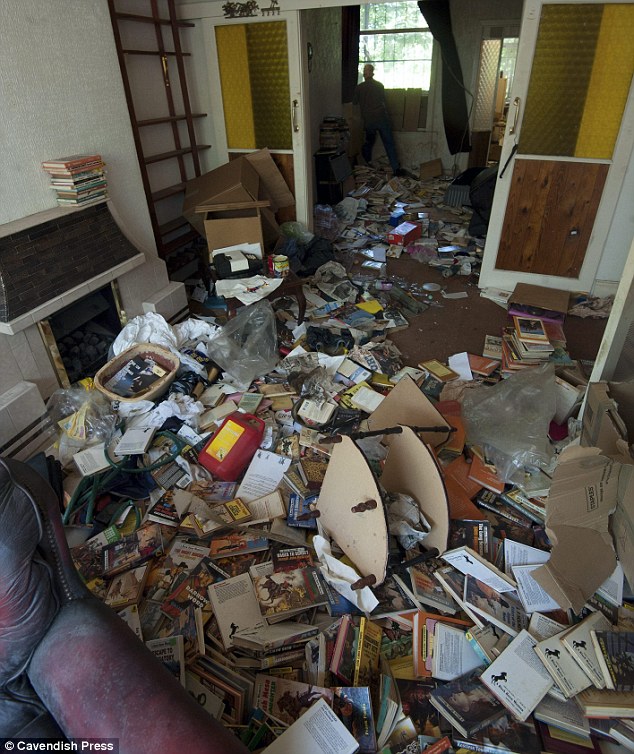
This screenshot has height=754, width=634. What are the coordinates of `fireplace` in the screenshot? It's located at (77, 338).